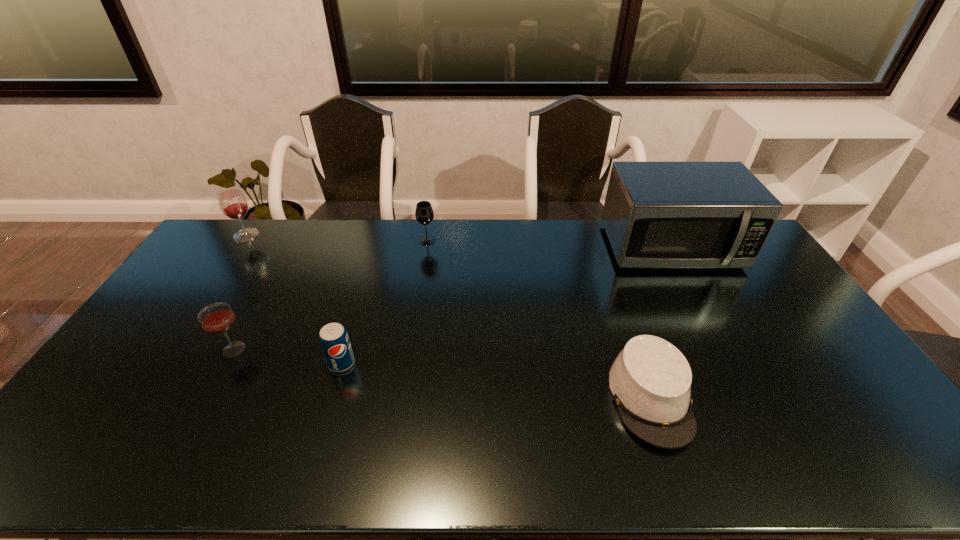
You are a GUI agent. You are given a task and a screenshot of the screen. Output one action in this format:
    pyautogui.click(x=<x>, y=<y>)
    Task: Click on the tallest object
    
    Given the screenshot: What is the action you would take?
    pyautogui.click(x=656, y=214)

Find the location of a particular element. Image resolution: width=960 pixels, height=540 pixels. the leftmost wineglass is located at coordinates (233, 204).

Where is `the rightmost wineglass`? The image size is (960, 540). the rightmost wineglass is located at coordinates (424, 214).

I want to click on the nearest wineglass, so click(217, 318).

Locate an element on the screen. the second wineglass from right to left is located at coordinates (217, 318).

At what (x,y) coordinates should I click in order to perform the action: click on the third object from left to right. Please return your answer as a coordinate pair (x, y). The width and height of the screenshot is (960, 540). Looking at the image, I should click on (334, 340).

Where is `hat`? The width and height of the screenshot is (960, 540). hat is located at coordinates (650, 379).

You are a GUI agent. You are given a task and a screenshot of the screen. Output one action in this format:
    pyautogui.click(x=<x>, y=<y>)
    Task: Click on the free space located 0.210m on the front-facing side of the tallest object
    The width and height of the screenshot is (960, 540).
    Given the screenshot: What is the action you would take?
    pyautogui.click(x=710, y=321)

At what (x,y) coordinates should I click in order to perform the action: click on vacant space situated 0.310m on the right of the leftmost wineglass. Please return your answer as a coordinate pair (x, y). Looking at the image, I should click on (339, 235).

At what (x,y) coordinates should I click in order to perform the action: click on vacant space located on the left of the third object from right to left. Please return your answer as a coordinate pair (x, y). Looking at the image, I should click on (402, 241).